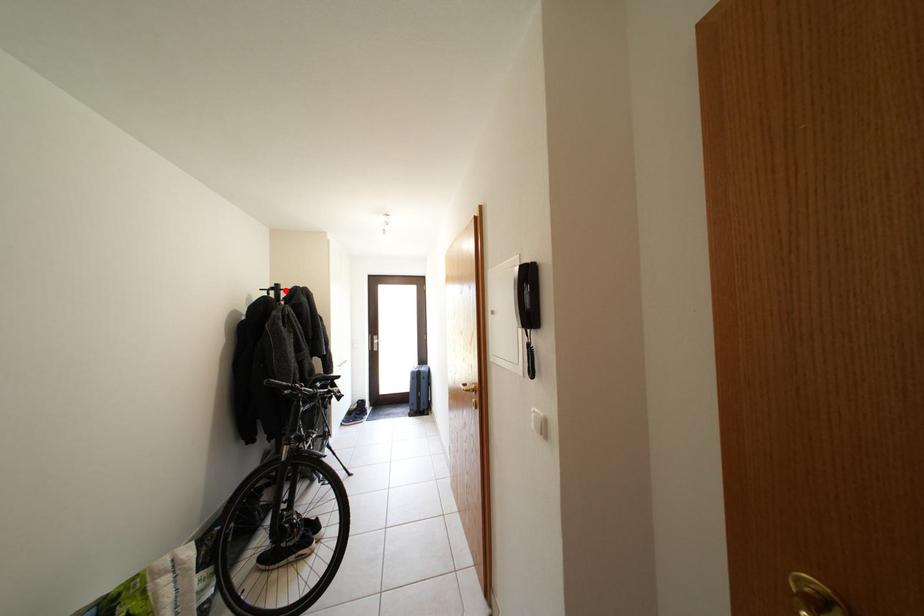
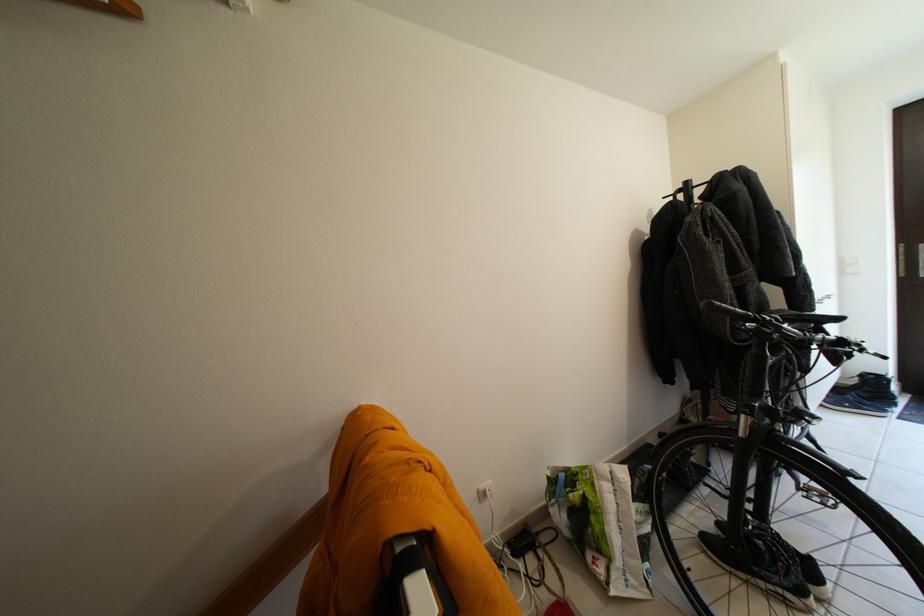
The point at the highlighted location is marked in the first image. Where is the corresponding point in the second image?

(696, 188)